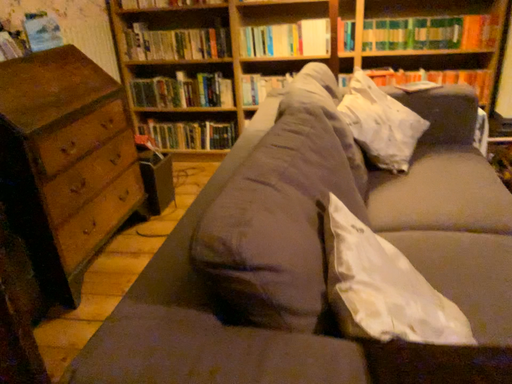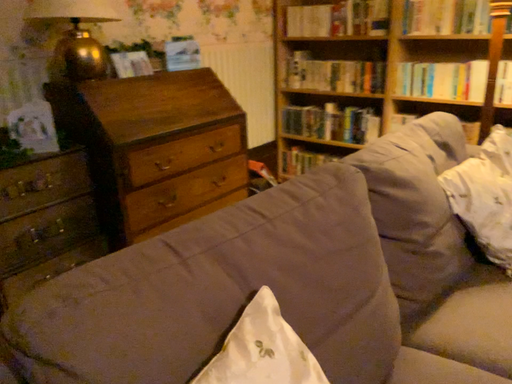
Question: How did the camera likely rotate when shooting the video?

Choices:
 (A) rotated upward
 (B) rotated downward

Answer: (A)